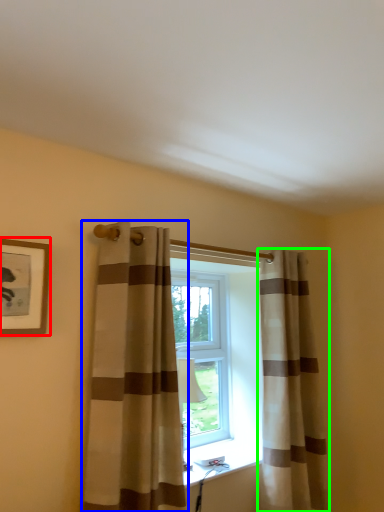
Question: Based on their relative distances, which object is nearer to picture frame (highlighted by a red box)? Choose from curtain (highlighted by a blue box) and curtain (highlighted by a green box).

Choices:
 (A) curtain
 (B) curtain

Answer: (A)